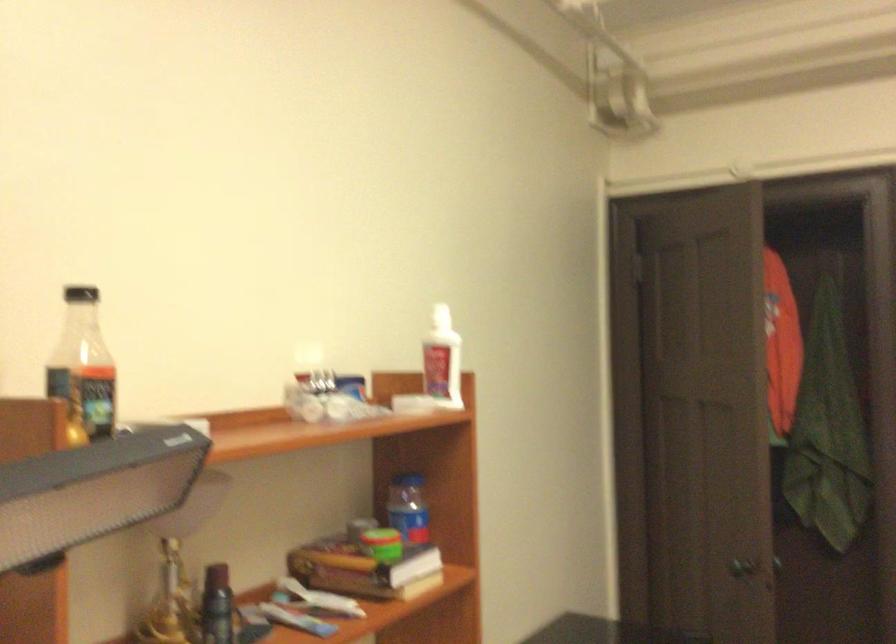
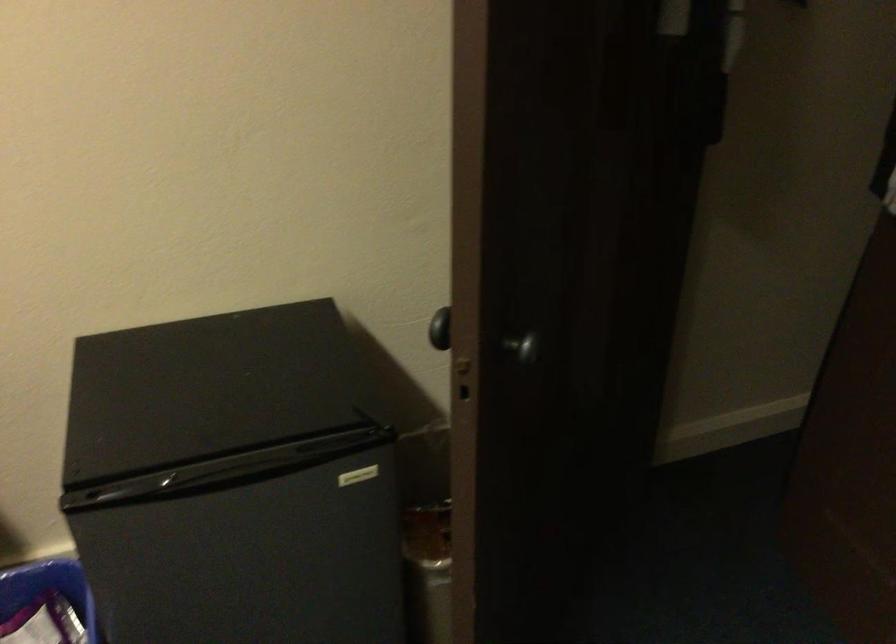
The point at (x=744, y=560) is marked in the first image. Where is the corresponding point in the second image?

(440, 328)